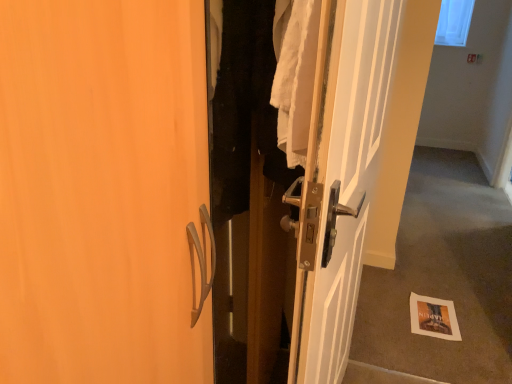
This screenshot has width=512, height=384. Describe the element at coordinates (356, 165) in the screenshot. I see `white glossy door at center` at that location.

Find the location of `transparent plastic window screen at upper right`. transparent plastic window screen at upper right is located at coordinates (454, 22).

Where is `white glossy door at center`? white glossy door at center is located at coordinates (356, 165).

From the picture: Do you think carpeted floor at lower right is within transparent plastic window screen at upper right, or outside of it?

The correct answer is: outside.

Is carpeted floor at lower right facing towards transparent plastic window screen at upper right?

No.

Which is behind, point (395, 269) or point (453, 27)?

The point (453, 27) is farther from the camera.

Can you confirm if transparent plastic window screen at upper right is taller than carpeted floor at lower right?

In fact, transparent plastic window screen at upper right may be shorter than carpeted floor at lower right.

Could you measure the distance between transparent plastic window screen at upper right and carpeted floor at lower right?

The distance of transparent plastic window screen at upper right from carpeted floor at lower right is 2.10 meters.

Is transparent plastic window screen at upper right to the left or to the right of carpeted floor at lower right in the image?

From the image, it's evident that transparent plastic window screen at upper right is to the right of carpeted floor at lower right.

How many degrees apart are the facing directions of transparent plastic window screen at upper right and carpeted floor at lower right?

The facing directions of transparent plastic window screen at upper right and carpeted floor at lower right are 1.27 degrees apart.

Find the location of a particular element. This screenshot has width=512, height=384. door located on the left of white paper at lower right is located at coordinates (356, 165).

Looking at their sizes, would you say white paper at lower right is wider or thinner than white glossy door at center?

In the image, white paper at lower right appears to be wider than white glossy door at center.

Consider the image. Who is smaller, white paper at lower right or white glossy door at center?

With smaller size is white paper at lower right.

Is there a large distance between white paper at lower right and white glossy door at center?

That's not correct — white paper at lower right is a little close to white glossy door at center.

Can we say white glossy door at center lies outside carpeted floor at lower right?

Yes, white glossy door at center is located beyond the bounds of carpeted floor at lower right.

Considering the sizes of objects white glossy door at center and carpeted floor at lower right in the image provided, who is taller, white glossy door at center or carpeted floor at lower right?

With more height is carpeted floor at lower right.

Measure the distance between white glossy door at center and carpeted floor at lower right.

Answer: 3.65 feet.

The height and width of the screenshot is (384, 512). Identify the location of corridor that is above the white glossy door at center (from the image's perspective). (443, 276).

From a real-world perspective, which object stands above the other?

transparent plastic window screen at upper right, from a real-world perspective.

From the image's perspective, which object appears higher, transparent plastic window screen at upper right or white glossy door at center?

transparent plastic window screen at upper right.

Would you say transparent plastic window screen at upper right is outside white glossy door at center?

Absolutely, transparent plastic window screen at upper right is external to white glossy door at center.

Are transparent plastic window screen at upper right and white glossy door at center far apart?

Yes, transparent plastic window screen at upper right and white glossy door at center are quite far apart.

Is transparent plastic window screen at upper right in front of or behind white paper at lower right in the image?

Visually, transparent plastic window screen at upper right is located behind white paper at lower right.

Is transparent plastic window screen at upper right directly adjacent to white paper at lower right?

No, transparent plastic window screen at upper right is not beside white paper at lower right.

From the image's perspective, which one is positioned higher, transparent plastic window screen at upper right or white paper at lower right?

From the image's view, transparent plastic window screen at upper right is above.

Find the location of `postcard in front of the transparent plastic window screen at upper right`. postcard in front of the transparent plastic window screen at upper right is located at coordinates (433, 317).

Who is shorter, white paper at lower right or transparent plastic window screen at upper right?

white paper at lower right.

Is point (449, 316) positioned in front of point (457, 21)?

Yes, it is.

I want to click on postcard located below the transparent plastic window screen at upper right (from the image's perspective), so click(x=433, y=317).

Consider the image. From the image's perspective, who appears lower, white paper at lower right or transparent plastic window screen at upper right?

white paper at lower right appears lower in the image.

In the image, there is a carpeted floor at lower right. Where is `window screen above it (from the image's perspective)`? The image size is (512, 384). window screen above it (from the image's perspective) is located at coordinates (454, 22).

The width and height of the screenshot is (512, 384). I want to click on window screen behind the carpeted floor at lower right, so click(x=454, y=22).

When comparing their distances from white paper at lower right, does white glossy door at center or transparent plastic window screen at upper right seem closer?

Based on the image, white glossy door at center appears to be nearer to white paper at lower right.

When comparing their distances from transparent plastic window screen at upper right, does carpeted floor at lower right or white paper at lower right seem further?

white paper at lower right.

From the image, which object appears to be nearer to white paper at lower right, white glossy door at center or carpeted floor at lower right?

carpeted floor at lower right is positioned closer to the anchor white paper at lower right.

Looking at the image, which one is located further to white glossy door at center, transparent plastic window screen at upper right or white paper at lower right?

transparent plastic window screen at upper right is positioned further to the anchor white glossy door at center.

When comparing their distances from carpeted floor at lower right, does white glossy door at center or transparent plastic window screen at upper right seem further?

Based on the image, transparent plastic window screen at upper right appears to be further to carpeted floor at lower right.

From the image, which object appears to be farther from carpeted floor at lower right, transparent plastic window screen at upper right or white paper at lower right?

Among the two, transparent plastic window screen at upper right is located further to carpeted floor at lower right.

When comparing their distances from carpeted floor at lower right, does white paper at lower right or white glossy door at center seem closer?

white paper at lower right lies closer to carpeted floor at lower right than the other object.

When comparing their distances from transparent plastic window screen at upper right, does white glossy door at center or white paper at lower right seem closer?

white paper at lower right is closer to transparent plastic window screen at upper right.

Find the location of a particular element. corridor between white glossy door at center and white paper at lower right from front to back is located at coordinates (443, 276).

The width and height of the screenshot is (512, 384). I want to click on postcard between carpeted floor at lower right and transparent plastic window screen at upper right along the z-axis, so click(x=433, y=317).

The height and width of the screenshot is (384, 512). What are the coordinates of `corridor located between white glossy door at center and transparent plastic window screen at upper right in the depth direction` in the screenshot? It's located at (443, 276).

This screenshot has height=384, width=512. What are the coordinates of `postcard between white glossy door at center and transparent plastic window screen at upper right along the z-axis` in the screenshot? It's located at (433, 317).